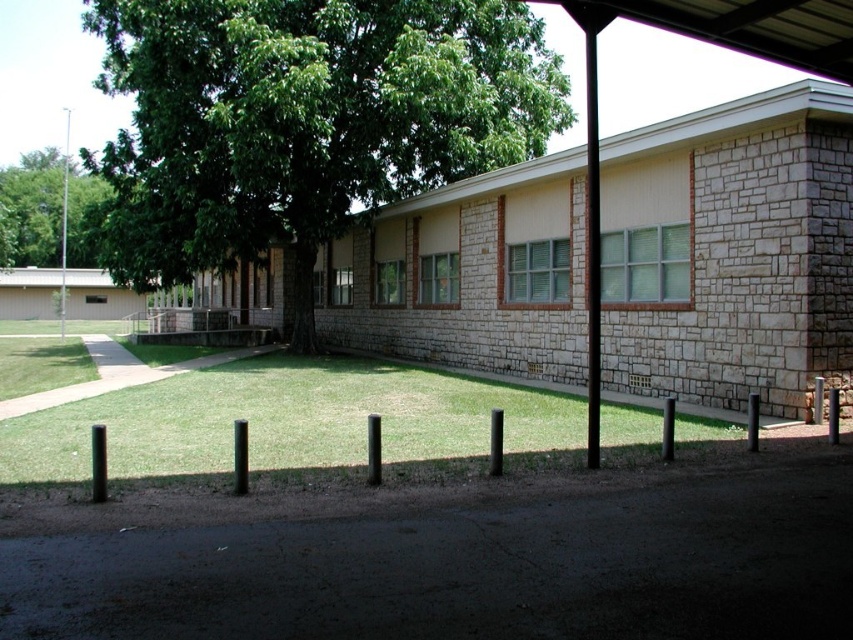
You are standing in front of the building and want to walk towards the black metal awning at upper center. Which direction should you head relative to the green leafy tree at upper left?

The black metal awning at upper center is to the right of the green leafy tree at upper left, so you should head towards the right direction relative to the green leafy tree at upper left to reach it.

You are standing on the paved pathway in front of the building and want to walk towards the green grass at center. Which direction should you walk to avoid the green leafy tree at upper left?

To avoid the green leafy tree at upper left, walk towards the green grass at center by moving away from the tree, as the green grass at center is smaller than the green leafy tree at upper left, indicating it is closer to you.